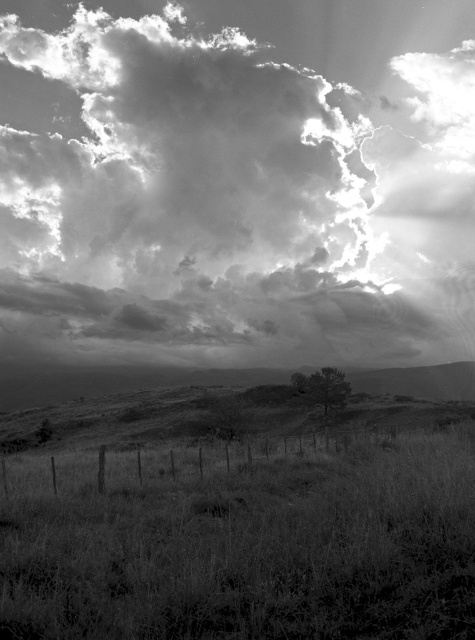
Who is positioned more to the left, cloudy sky at upper center or grassy at lower center?

Positioned to the left is grassy at lower center.

Is point (34, 252) farther from viewer compared to point (216, 568)?

Yes, point (34, 252) is behind point (216, 568).

This screenshot has width=475, height=640. Identify the location of cloudy sky at upper center. (237, 188).

Does cloudy sky at upper center have a larger size compared to dark green textured tree at center?

Yes, cloudy sky at upper center is bigger than dark green textured tree at center.

Can you confirm if cloudy sky at upper center is thinner than dark green textured tree at center?

Incorrect, cloudy sky at upper center's width is not less than dark green textured tree at center's.

What do you see at coordinates (237, 188) in the screenshot? The image size is (475, 640). I see `cloudy sky at upper center` at bounding box center [237, 188].

Identify the location of cloudy sky at upper center. (237, 188).

Does grassy at lower center lie behind dark green textured tree at center?

No, grassy at lower center is closer to the viewer.

Can you confirm if grassy at lower center is shorter than dark green textured tree at center?

Yes.

This screenshot has width=475, height=640. In order to click on grassy at lower center in this screenshot , I will do point(256,552).

This screenshot has height=640, width=475. Identify the location of grassy at lower center. (256, 552).